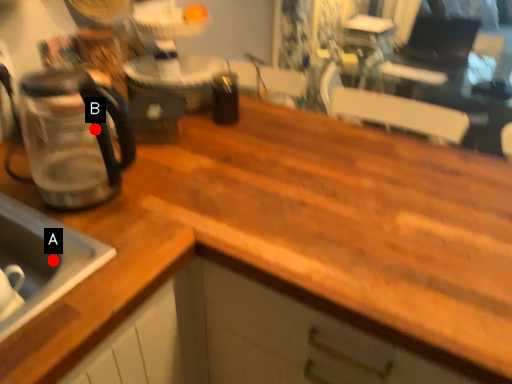
Question: Two points are circled on the image, labeled by A and B beside each circle. Which of the following is the closest to the observer?

Choices:
 (A) A is closer
 (B) B is closer

Answer: (A)